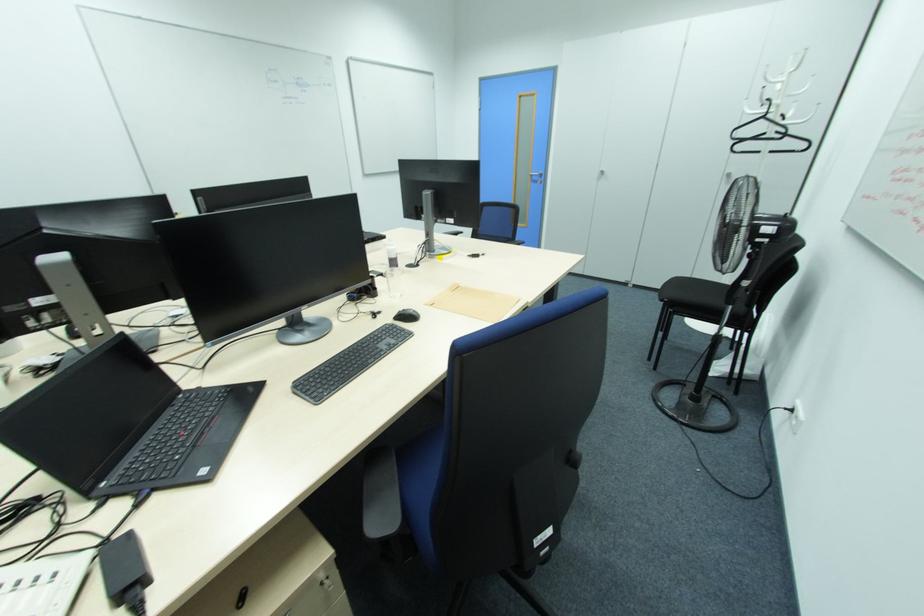
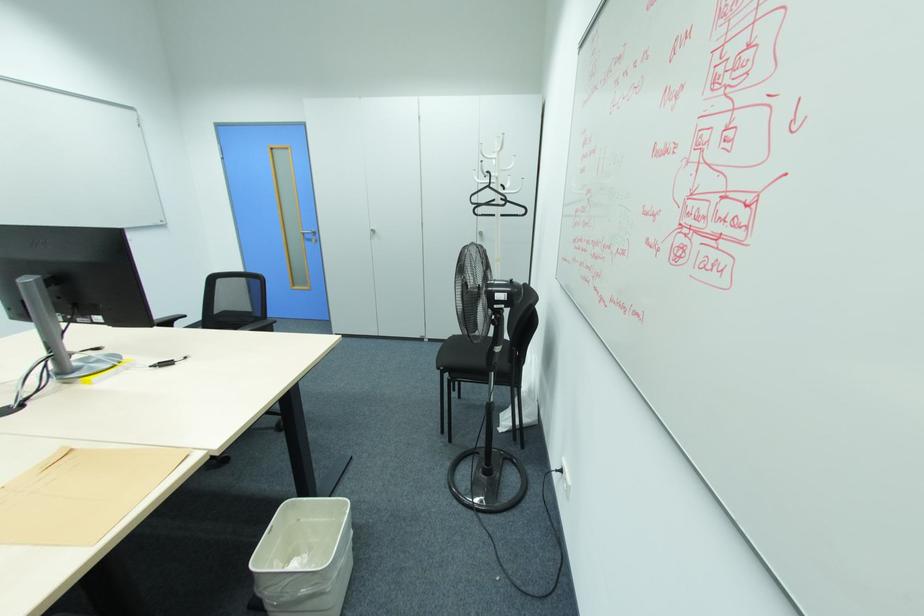
Find the pixel in the second image that matches (460,285) in the first image.

(78, 448)